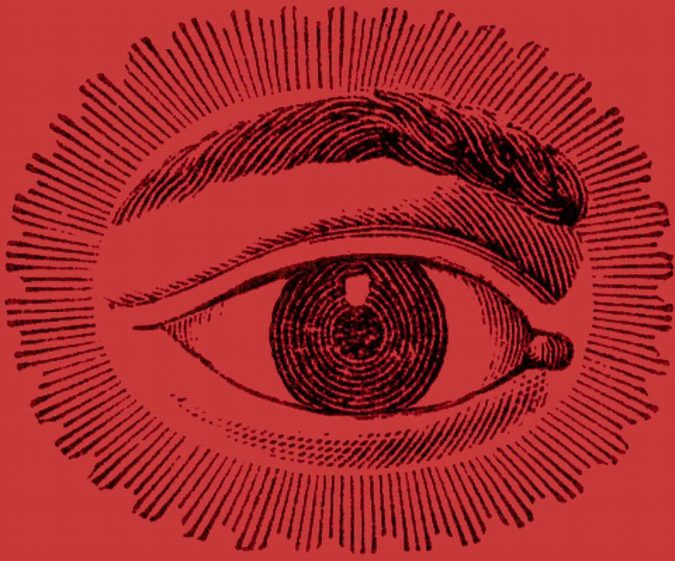
This screenshot has height=561, width=675. What are the coordinates of `duct` in the screenshot? It's located at (553, 354).